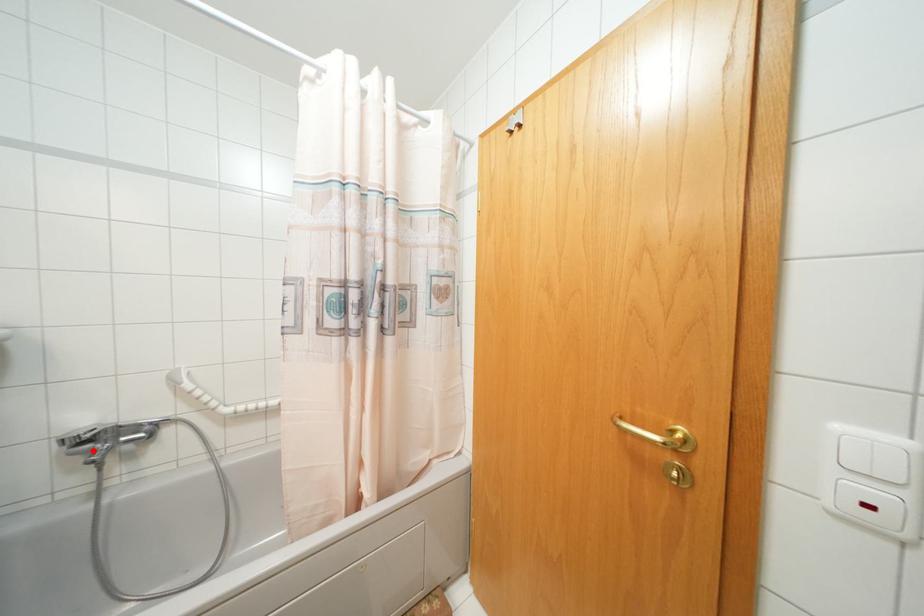
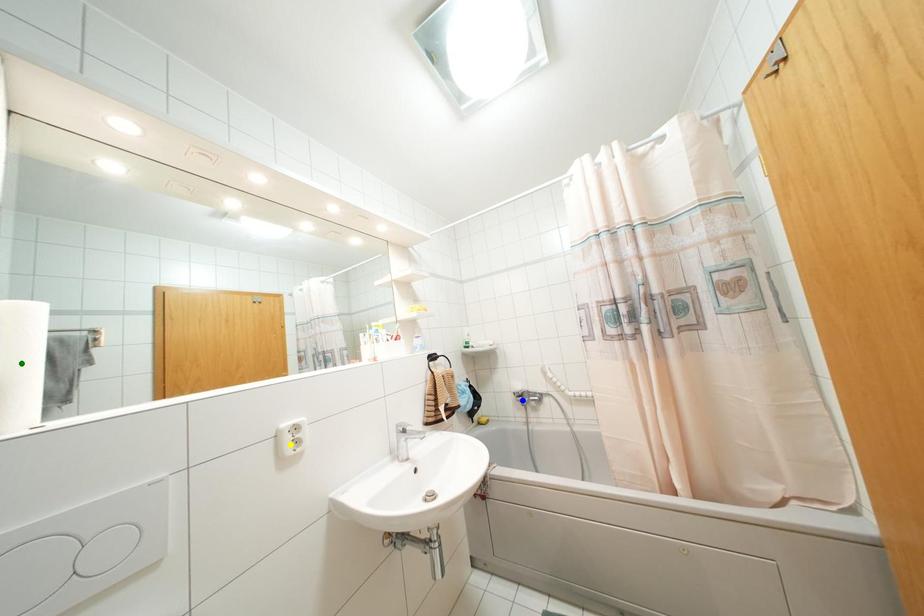
Question: I am providing you with two images of the same scene from different viewpoints. A red point is marked on the first image. You are given multiple points on the second image. Which point in image 2 represents the same 3d spot as the red point in image 1?

Choices:
 (A) blue point
 (B) green point
 (C) yellow point

Answer: (A)